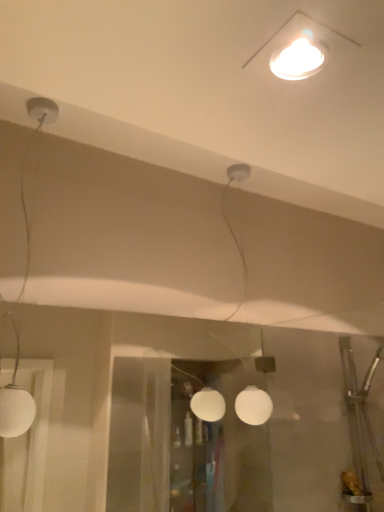
Question: Which direction should I rotate to look at white glossy light fixture at upper center, the 3th lamp viewed from the back, — up or down?

Choices:
 (A) up
 (B) down

Answer: (A)

Question: Can we say white glossy light fixture at upper center, the 3th lamp viewed from the back, lies outside white matte globe lamp at left, arranged as the second lamp when viewed from the back?

Choices:
 (A) yes
 (B) no

Answer: (A)

Question: Can you confirm if white glossy light fixture at upper center, marked as the first lamp in a right-to-left arrangement, is shorter than white matte globe lamp at left, the third lamp from the right?

Choices:
 (A) no
 (B) yes

Answer: (B)

Question: Can white matte globe lamp at left, which ranks as the 1th lamp in left-to-right order, be found inside white glossy light fixture at upper center, which appears as the third lamp when viewed from the left?

Choices:
 (A) no
 (B) yes

Answer: (A)

Question: Can you confirm if white glossy light fixture at upper center, which appears as the third lamp when viewed from the left, is smaller than white matte globe lamp at left, which is counted as the second lamp, starting from the front?

Choices:
 (A) no
 (B) yes

Answer: (B)

Question: Considering the relative sizes of white glossy light fixture at upper center, marked as the first lamp in a right-to-left arrangement, and white matte globe lamp at left, which ranks as the 1th lamp in left-to-right order, in the image provided, is white glossy light fixture at upper center, marked as the first lamp in a right-to-left arrangement, bigger than white matte globe lamp at left, which ranks as the 1th lamp in left-to-right order,?

Choices:
 (A) no
 (B) yes

Answer: (A)

Question: From the image's perspective, is white glossy light fixture at upper center, the 1th lamp from the front, beneath white matte globe lamp at left, arranged as the second lamp when viewed from the back?

Choices:
 (A) yes
 (B) no

Answer: (B)

Question: Can you see white matte globe at center, which is the 1th lamp from back to front, touching white matte globe lamp at left, which ranks as the 1th lamp in left-to-right order?

Choices:
 (A) yes
 (B) no

Answer: (B)

Question: Is white matte globe at center, which appears as the 2th lamp when viewed from the right, positioned with its back to white matte globe lamp at left, which is counted as the second lamp, starting from the front?

Choices:
 (A) no
 (B) yes

Answer: (A)

Question: Would you consider white matte globe at center, which is the 1th lamp from back to front, to be distant from white matte globe lamp at left, arranged as the second lamp when viewed from the back?

Choices:
 (A) no
 (B) yes

Answer: (B)

Question: Does white matte globe at center, which is the 1th lamp from back to front, appear on the right side of white matte globe lamp at left, arranged as the second lamp when viewed from the back?

Choices:
 (A) yes
 (B) no

Answer: (A)

Question: Is white matte globe at center, the 2th lamp from the left, not within white matte globe lamp at left, which is counted as the second lamp, starting from the front?

Choices:
 (A) yes
 (B) no

Answer: (A)

Question: Is white matte globe at center, the 2th lamp from the left, at the left side of white matte globe lamp at left, the third lamp from the right?

Choices:
 (A) no
 (B) yes

Answer: (A)

Question: Considering the relative sizes of white glossy light fixture at upper center, the 3th lamp viewed from the back, and white matte globe at center, the 2th lamp from the left, in the image provided, is white glossy light fixture at upper center, the 3th lamp viewed from the back, taller than white matte globe at center, the 2th lamp from the left,?

Choices:
 (A) yes
 (B) no

Answer: (B)